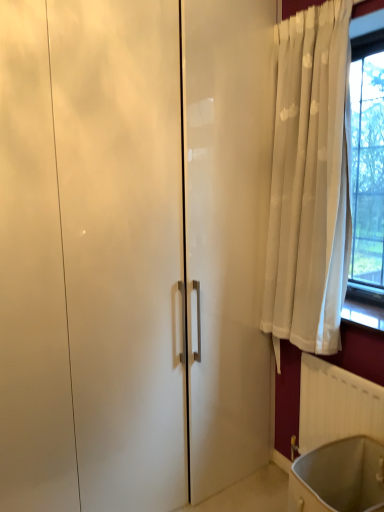
Question: In terms of height, does white plastic radiator at lower right look taller or shorter compared to matte white bath at lower right?

Choices:
 (A) tall
 (B) short

Answer: (A)

Question: From the image's perspective, relative to matte white bath at lower right, is white plastic radiator at lower right above or below?

Choices:
 (A) above
 (B) below

Answer: (A)

Question: Visually, is white plastic radiator at lower right positioned to the left or to the right of matte white bath at lower right?

Choices:
 (A) left
 (B) right

Answer: (B)

Question: From their relative heights in the image, would you say matte white bath at lower right is taller or shorter than white plastic radiator at lower right?

Choices:
 (A) short
 (B) tall

Answer: (A)

Question: Relative to white plastic radiator at lower right, is matte white bath at lower right in front or behind?

Choices:
 (A) front
 (B) behind

Answer: (A)

Question: Looking at their shapes, would you say matte white bath at lower right is wider or thinner than white plastic radiator at lower right?

Choices:
 (A) wide
 (B) thin

Answer: (A)

Question: Considering the positions of matte white bath at lower right and white plastic radiator at lower right in the image, is matte white bath at lower right bigger or smaller than white plastic radiator at lower right?

Choices:
 (A) big
 (B) small

Answer: (A)